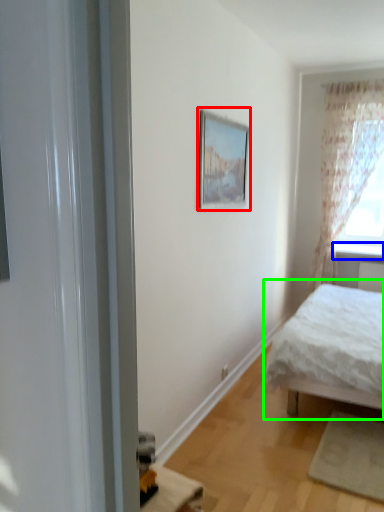
Question: Which is farther away from picture frame (highlighted by a red box)? window sill (highlighted by a blue box) or bed (highlighted by a green box)?

Choices:
 (A) window sill
 (B) bed

Answer: (A)